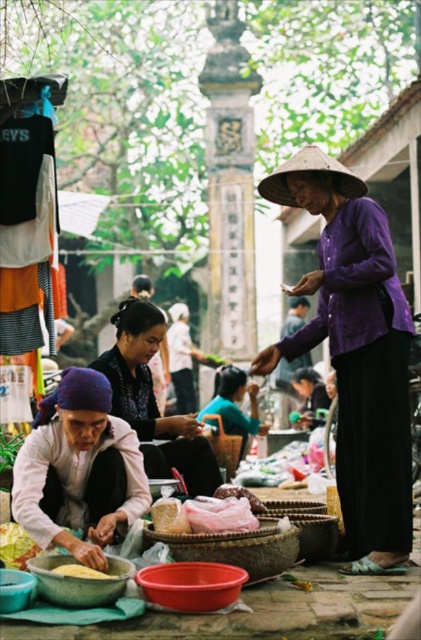
Question: Observing the image, what is the correct spatial positioning of white fabric headscarf at center in reference to yellow matte corn at lower center?

Choices:
 (A) below
 (B) above

Answer: (B)

Question: Which object appears farthest from the camera in this image?

Choices:
 (A) matte purple blouse at center
 (B) yellow matte corn at lower center
 (C) white fabric headscarf at center

Answer: (A)

Question: Does purple matte hat at upper right have a larger size compared to yellow matte corn at lower center?

Choices:
 (A) yes
 (B) no

Answer: (A)

Question: Among these points, which one is farthest from the camera?

Choices:
 (A) (77, 566)
 (B) (391, 449)
 (C) (132, 332)

Answer: (C)

Question: Can you confirm if purple matte hat at upper right is positioned below matte purple blouse at center?

Choices:
 (A) yes
 (B) no

Answer: (B)

Question: Among these points, which one is farthest from the camera?

Choices:
 (A) (143, 417)
 (B) (199, 410)
 (C) (381, 230)

Answer: (B)